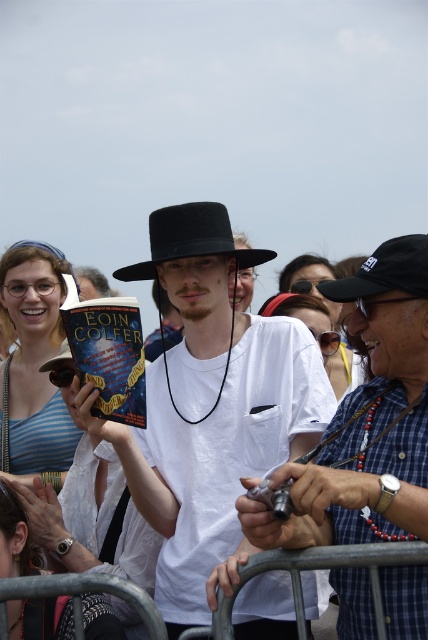
Question: Is white matte shirt at center bigger than matte black hat at center?

Choices:
 (A) no
 (B) yes

Answer: (A)

Question: Does white matte shirt at center come behind black fabric cap at center?

Choices:
 (A) yes
 (B) no

Answer: (B)

Question: Based on their relative distances, which object is nearer to the black fabric cap at center?

Choices:
 (A) black felt fedora at center
 (B) white matte shirt at center

Answer: (A)

Question: Which object is positioned farthest from the black felt fedora at center?

Choices:
 (A) matte black hat at center
 (B) white matte shirt at center
 (C) black fabric cap at center

Answer: (A)

Question: Is white matte shirt at center thinner than black fabric cap at center?

Choices:
 (A) yes
 (B) no

Answer: (B)

Question: Which of the following is the farthest from the observer?

Choices:
 (A) (133, 272)
 (B) (416, 300)
 (C) (201, 621)
 (D) (321, 284)

Answer: (A)